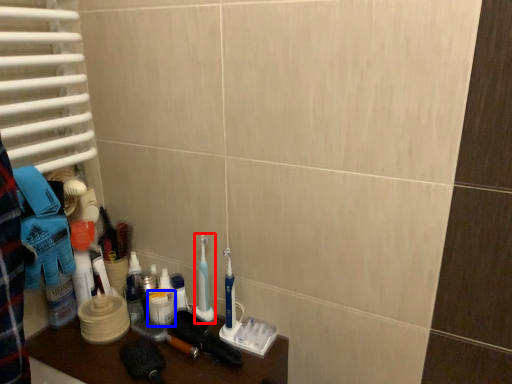
Question: Among these objects, which one is nearest to the camera, toothbrush (highlighted by a red box) or mouthwash (highlighted by a blue box)?

Choices:
 (A) toothbrush
 (B) mouthwash

Answer: (A)